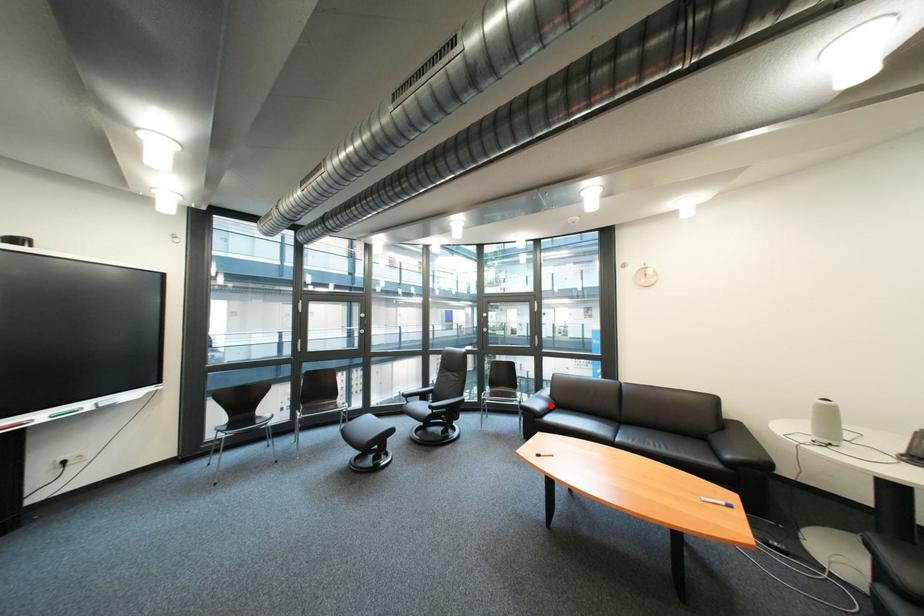
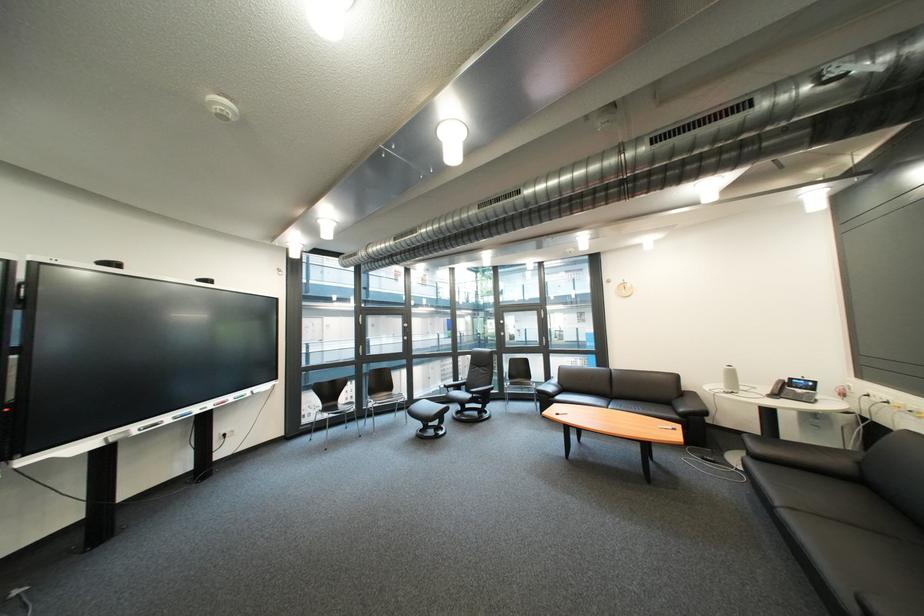
Question: I am providing you with two images of the same scene from different viewpoints. Given a red point in image1, look at the same physical point in image2. Is it:

Choices:
 (A) Closer to the viewpoint
 (B) Farther from the viewpoint

Answer: (B)